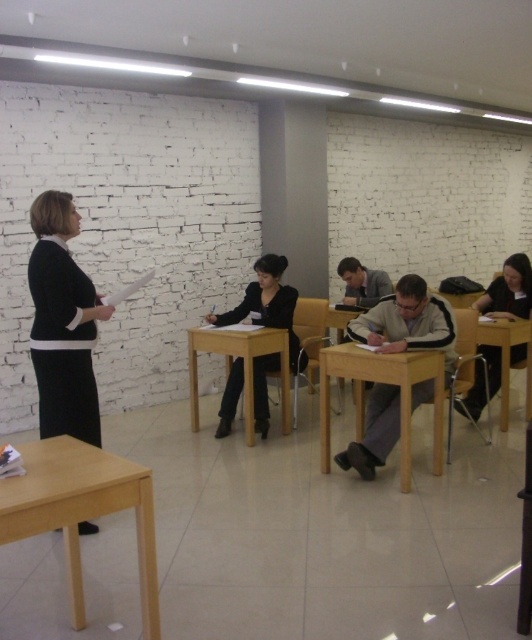
Question: Is the position of black fabric jacket at lower right less distant than that of brown wooden chair at center?

Choices:
 (A) no
 (B) yes

Answer: (B)

Question: Observing the image, what is the correct spatial positioning of light brown wood table at center in reference to wooden table at center?

Choices:
 (A) left
 (B) right

Answer: (B)

Question: Which object appears closest to the camera in this image?

Choices:
 (A) wooden table at right
 (B) wooden table at center
 (C) brown wooden chair at center
 (D) black glossy table at lower right

Answer: (D)

Question: Which point appears closest to the camera in this image?

Choices:
 (A) (409, 426)
 (B) (43, 232)
 (C) (282, 323)

Answer: (B)

Question: Which point is farther from the camera taking this photo?

Choices:
 (A) tap(305, 332)
 (B) tap(476, 308)

Answer: (A)

Question: Can you confirm if black matte skirt at left is smaller than black matte jacket at center?

Choices:
 (A) no
 (B) yes

Answer: (B)